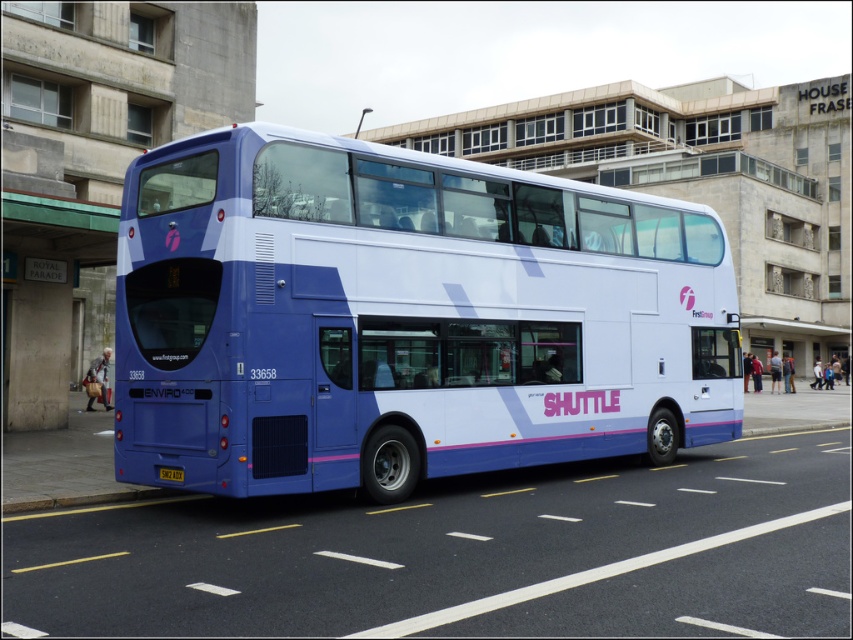
You are standing in front of the double decker bus and want to take a photo. You notice two points marked on the bus. The first point is at coordinate point (239,138) and the second is at point (51,292). Which point will appear larger in your photo?

Point (239,138) will appear larger in the photo because it is closer to the camera than point (51,292).